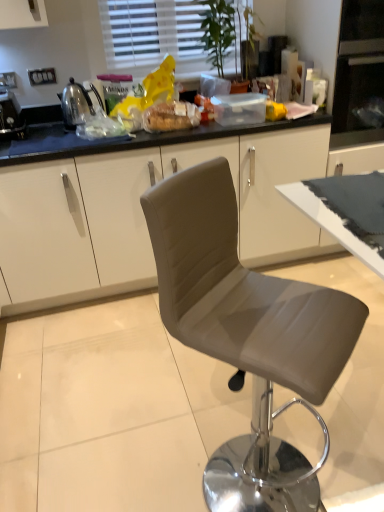
The image size is (384, 512). What do you see at coordinates (171, 116) in the screenshot?
I see `translucent plastic bread at center` at bounding box center [171, 116].

Describe the element at coordinates (11, 116) in the screenshot. This screenshot has width=384, height=512. I see `metallic silver toaster at left, the 2th appliance positioned from the right` at that location.

Locate an element on the screen. shiny metallic kettle at left, marked as the 1th appliance in a right-to-left arrangement is located at coordinates (75, 104).

Identify the location of white blinds at upper center. (154, 35).

Where is `translucent plastic bread at center`? This screenshot has width=384, height=512. translucent plastic bread at center is located at coordinates (171, 116).

Which object is closer to the camera taking this photo, translucent plastic bread at center or white blinds at upper center?

translucent plastic bread at center.

Is translucent plastic bread at center with white blinds at upper center?

No, translucent plastic bread at center is not touching white blinds at upper center.

Consider the image. How different are the orientations of translucent plastic bread at center and white blinds at upper center in degrees?

They differ by 0.0463 degrees in their facing directions.

In the scene shown: Could you tell me if translucent plastic bread at center is turned towards white blinds at upper center?

No, translucent plastic bread at center is not facing towards white blinds at upper center.

What's the angular difference between shiny metallic kettle at left, marked as the 1th appliance in a right-to-left arrangement, and translucent plastic bread at center's facing directions?

shiny metallic kettle at left, marked as the 1th appliance in a right-to-left arrangement, and translucent plastic bread at center are facing 6.17 degrees away from each other.

Locate an element on the screen. appliance that is the 2nd one when counting upward from the translucent plastic bread at center (from the image's perspective) is located at coordinates (75, 104).

Looking at the image, does shiny metallic kettle at left, marked as the 1th appliance in a right-to-left arrangement, seem bigger or smaller compared to translucent plastic bread at center?

Clearly, shiny metallic kettle at left, marked as the 1th appliance in a right-to-left arrangement, is larger in size than translucent plastic bread at center.

From a real-world perspective, relative to metallic silver toaster at left, which is the 1th appliance in left-to-right order, is translucent plastic bread at center vertically above or below?

translucent plastic bread at center is situated lower than metallic silver toaster at left, which is the 1th appliance in left-to-right order, in the real world.

Could you tell me if translucent plastic bread at center is turned towards metallic silver toaster at left, the 2th appliance positioned from the right?

No.

Considering the points (191, 124) and (0, 94), which point is in front, point (191, 124) or point (0, 94)?

The point (191, 124) is in front.

Is shiny metallic kettle at left, which is counted as the second appliance, starting from the left, placed right next to metallic silver toaster at left, which is the 1th appliance in left-to-right order?

No, shiny metallic kettle at left, which is counted as the second appliance, starting from the left, is not next to metallic silver toaster at left, which is the 1th appliance in left-to-right order.

At what (x,y) coordinates should I click in order to perform the action: click on appliance below the shiny metallic kettle at left, marked as the 1th appliance in a right-to-left arrangement (from a real-world perspective). Please return your answer as a coordinate pair (x, y). Looking at the image, I should click on (11, 116).

Is shiny metallic kettle at left, marked as the 1th appliance in a right-to-left arrangement, further to the viewer compared to metallic silver toaster at left, the 2th appliance positioned from the right?

Yes, shiny metallic kettle at left, marked as the 1th appliance in a right-to-left arrangement, is behind metallic silver toaster at left, the 2th appliance positioned from the right.

In the image, is white blinds at upper center positioned in front of or behind translucent plastic bread at center?

white blinds at upper center is positioned farther from the viewer than translucent plastic bread at center.

Which is more to the left, white blinds at upper center or translucent plastic bread at center?

Positioned to the left is translucent plastic bread at center.

Measure the distance between white blinds at upper center and translucent plastic bread at center.

23.93 inches.

Is white blinds at upper center bigger or smaller than translucent plastic bread at center?

In the image, white blinds at upper center appears to be larger than translucent plastic bread at center.

From a real-world perspective, is white blinds at upper center positioned above or below satin grey chair at center?

Clearly, from a real-world perspective, white blinds at upper center is above satin grey chair at center.

Is point (117, 4) closer or farther from the camera than point (287, 374)?

Point (117, 4) is positioned farther from the camera compared to point (287, 374).

Is white blinds at upper center facing away from satin grey chair at center?

white blinds at upper center is not turned away from satin grey chair at center.

Considering the relative sizes of white blinds at upper center and satin grey chair at center in the image provided, is white blinds at upper center smaller than satin grey chair at center?

Correct, white blinds at upper center occupies less space than satin grey chair at center.

Is metallic silver toaster at left, which is the 1th appliance in left-to-right order, at the right side of white blinds at upper center?

No, metallic silver toaster at left, which is the 1th appliance in left-to-right order, is not to the right of white blinds at upper center.

Is metallic silver toaster at left, the 2th appliance positioned from the right, beside white blinds at upper center?

No, metallic silver toaster at left, the 2th appliance positioned from the right, is not making contact with white blinds at upper center.

From a real-world perspective, who is located higher, metallic silver toaster at left, the 2th appliance positioned from the right, or white blinds at upper center?

From a 3D spatial view, white blinds at upper center is above.

Find the location of `window located above the translucent plastic bread at center (from a real-world perspective)`. window located above the translucent plastic bread at center (from a real-world perspective) is located at coordinates (154, 35).

Locate an element on the screen. This screenshot has height=512, width=384. appliance that appears behind the translucent plastic bread at center is located at coordinates (75, 104).

Which object lies nearer to the anchor point metallic silver toaster at left, which is the 1th appliance in left-to-right order, shiny metallic kettle at left, marked as the 1th appliance in a right-to-left arrangement, or translucent plastic bread at center?

shiny metallic kettle at left, marked as the 1th appliance in a right-to-left arrangement, is closer to metallic silver toaster at left, which is the 1th appliance in left-to-right order.

Considering their positions, is white blinds at upper center positioned closer to metallic silver toaster at left, the 2th appliance positioned from the right, than translucent plastic bread at center?

translucent plastic bread at center is positioned closer to the anchor metallic silver toaster at left, the 2th appliance positioned from the right.

Which object lies nearer to the anchor point satin grey chair at center, translucent plastic bread at center or white blinds at upper center?

translucent plastic bread at center is positioned closer to the anchor satin grey chair at center.

Considering their positions, is translucent plastic bread at center positioned further to satin grey chair at center than shiny metallic kettle at left, marked as the 1th appliance in a right-to-left arrangement?

Based on the image, shiny metallic kettle at left, marked as the 1th appliance in a right-to-left arrangement, appears to be further to satin grey chair at center.

When comparing their distances from shiny metallic kettle at left, marked as the 1th appliance in a right-to-left arrangement, does translucent plastic bread at center or white blinds at upper center seem closer?

translucent plastic bread at center lies closer to shiny metallic kettle at left, marked as the 1th appliance in a right-to-left arrangement, than the other object.

Looking at the image, which one is located further to translucent plastic bread at center, metallic silver toaster at left, which is the 1th appliance in left-to-right order, or shiny metallic kettle at left, marked as the 1th appliance in a right-to-left arrangement?

metallic silver toaster at left, which is the 1th appliance in left-to-right order, is further to translucent plastic bread at center.

Which object lies nearer to the anchor point shiny metallic kettle at left, marked as the 1th appliance in a right-to-left arrangement, white blinds at upper center or satin grey chair at center?

white blinds at upper center is closer to shiny metallic kettle at left, marked as the 1th appliance in a right-to-left arrangement.

Which object lies nearer to the anchor point translucent plastic bread at center, white blinds at upper center or metallic silver toaster at left, which is the 1th appliance in left-to-right order?

Among the two, white blinds at upper center is located nearer to translucent plastic bread at center.

Locate an element on the screen. food located between metallic silver toaster at left, the 2th appliance positioned from the right, and white blinds at upper center in the left-right direction is located at coordinates (x=171, y=116).

The height and width of the screenshot is (512, 384). Find the location of `appliance situated between metallic silver toaster at left, which is the 1th appliance in left-to-right order, and translucent plastic bread at center from left to right`. appliance situated between metallic silver toaster at left, which is the 1th appliance in left-to-right order, and translucent plastic bread at center from left to right is located at coordinates (75, 104).

Where is `food between shiny metallic kettle at left, marked as the 1th appliance in a right-to-left arrangement, and satin grey chair at center, in the vertical direction`? food between shiny metallic kettle at left, marked as the 1th appliance in a right-to-left arrangement, and satin grey chair at center, in the vertical direction is located at coordinates (171, 116).

In order to click on appliance between metallic silver toaster at left, the 2th appliance positioned from the right, and white blinds at upper center in this screenshot , I will do `click(75, 104)`.